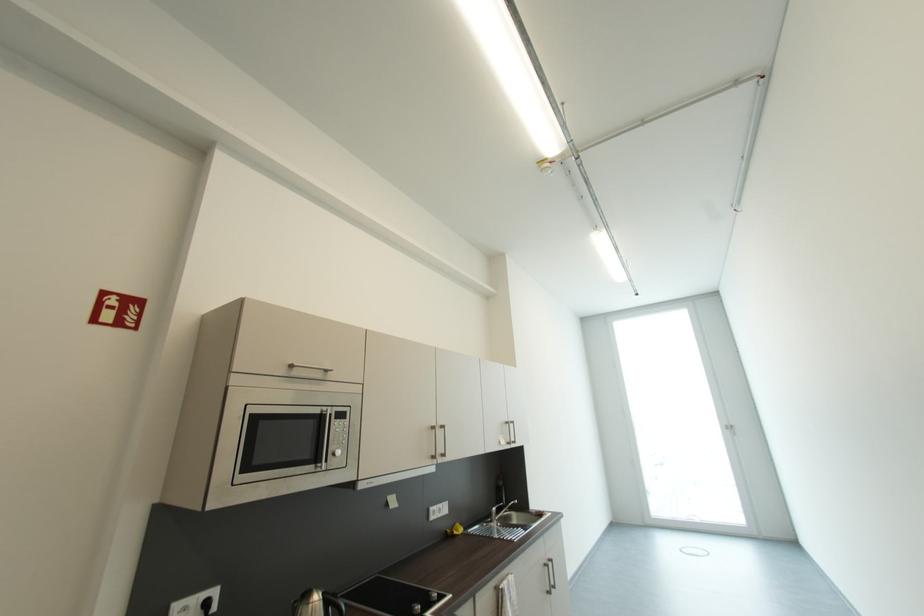
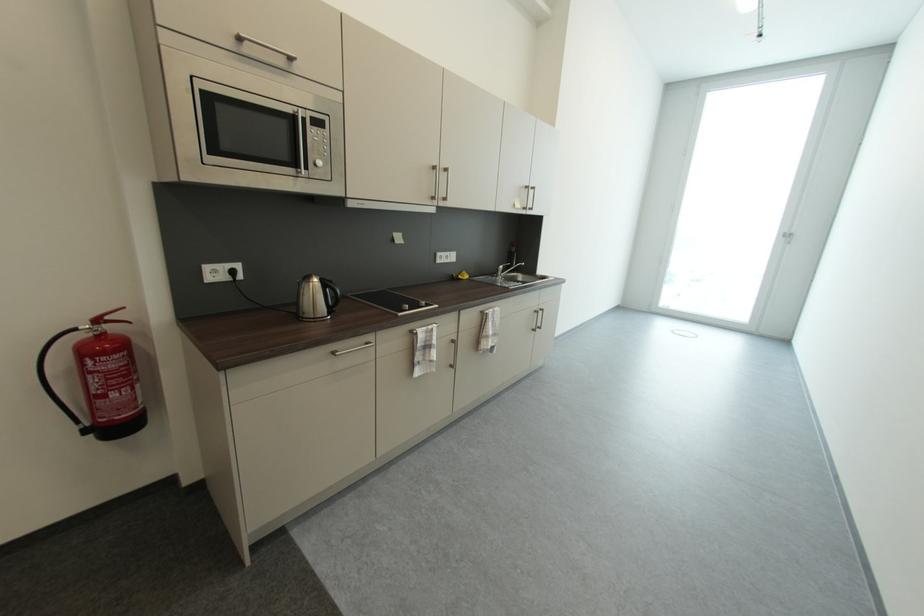
In the second image, find the point that corresponds to pixel 325 413 in the first image.

(297, 113)